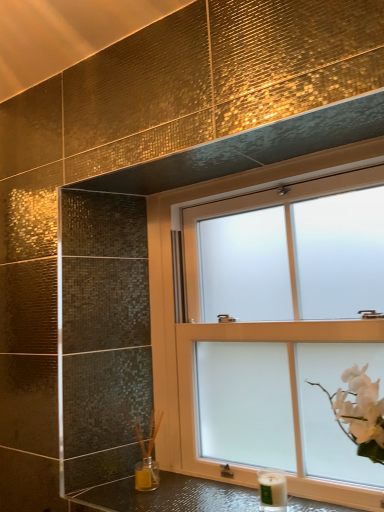
Question: Is there a large distance between white matte candle at lower right and shiny metallic counter top at lower center?

Choices:
 (A) no
 (B) yes

Answer: (A)

Question: Is white matte candle at lower right next to shiny metallic counter top at lower center?

Choices:
 (A) yes
 (B) no

Answer: (B)

Question: From a real-world perspective, is white matte candle at lower right on top of shiny metallic counter top at lower center?

Choices:
 (A) yes
 (B) no

Answer: (A)

Question: Considering the relative sizes of white matte candle at lower right and shiny metallic counter top at lower center in the image provided, is white matte candle at lower right wider than shiny metallic counter top at lower center?

Choices:
 (A) no
 (B) yes

Answer: (A)

Question: Is white matte candle at lower right positioned in front of shiny metallic counter top at lower center?

Choices:
 (A) yes
 (B) no

Answer: (B)

Question: Is point (190, 434) positioned closer to the camera than point (269, 494)?

Choices:
 (A) farther
 (B) closer

Answer: (A)

Question: Which is correct: frosted glass window at upper center is inside white matte candle at lower right, or outside of it?

Choices:
 (A) inside
 (B) outside

Answer: (B)

Question: Relative to white matte candle at lower right, is frosted glass window at upper center in front or behind?

Choices:
 (A) front
 (B) behind

Answer: (A)

Question: From a real-world perspective, is frosted glass window at upper center above or below white matte candle at lower right?

Choices:
 (A) above
 (B) below

Answer: (A)

Question: From the image's perspective, is frosted glass window at upper center positioned above or below shiny metallic counter top at lower center?

Choices:
 (A) above
 (B) below

Answer: (A)

Question: Is frosted glass window at upper center inside or outside of shiny metallic counter top at lower center?

Choices:
 (A) inside
 (B) outside

Answer: (B)

Question: Does point (360, 495) appear closer or farther from the camera than point (188, 508)?

Choices:
 (A) closer
 (B) farther

Answer: (A)

Question: Is frosted glass window at upper center taller or shorter than shiny metallic counter top at lower center?

Choices:
 (A) tall
 (B) short

Answer: (A)

Question: Is white matte candle at lower right taller or shorter than shiny metallic counter top at lower center?

Choices:
 (A) short
 (B) tall

Answer: (B)

Question: Considering the positions of point (258, 474) and point (208, 507), is point (258, 474) closer or farther from the camera than point (208, 507)?

Choices:
 (A) closer
 (B) farther

Answer: (B)